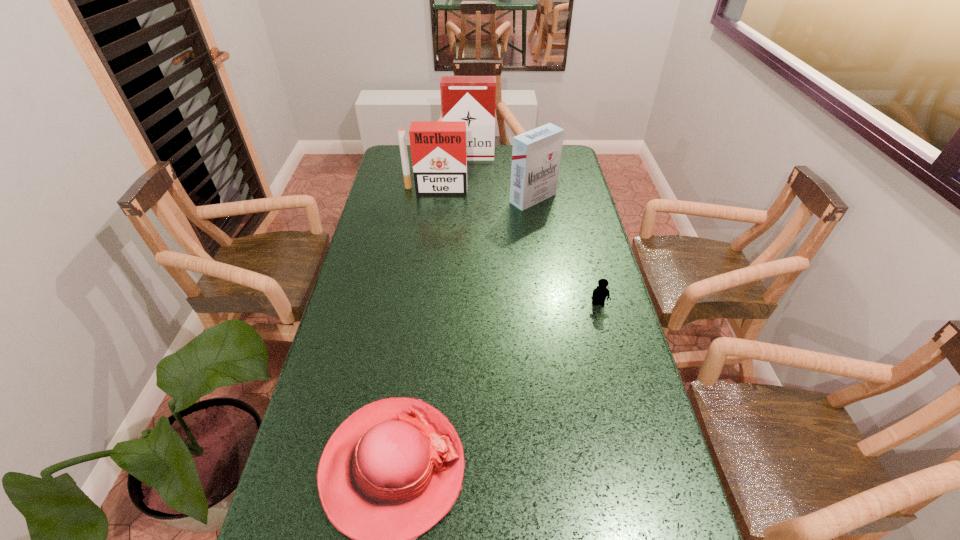
At what (x,y) coordinates should I click in order to perform the action: click on the tallest object. Please return your answer as a coordinate pair (x, y). This screenshot has width=960, height=540. Looking at the image, I should click on (472, 99).

I want to click on the tallest cigarette case, so click(x=472, y=99).

You are a GUI agent. You are given a task and a screenshot of the screen. Output one action in this format:
    pyautogui.click(x=<x>, y=<y>)
    Task: Click on the rightmost cigarette case
    
    Given the screenshot: What is the action you would take?
    pyautogui.click(x=536, y=154)

What are the coordinates of `the fourth farthest object` in the screenshot? It's located at (600, 293).

The height and width of the screenshot is (540, 960). I want to click on the shortest object, so click(x=600, y=293).

At what (x,y) coordinates should I click in order to perform the action: click on vacant point located on the front-facing side of the tallest cigarette case. Please return your answer as a coordinate pair (x, y). The width and height of the screenshot is (960, 540). Looking at the image, I should click on (468, 177).

You are a GUI agent. You are given a task and a screenshot of the screen. Output one action in this format:
    pyautogui.click(x=<x>, y=<y>)
    Task: Click on the vacant space located 0.260m on the back of the rightmost cigarette case
    This screenshot has width=960, height=540.
    Given the screenshot: What is the action you would take?
    pyautogui.click(x=526, y=156)

What are the coordinates of `free space located 0.140m on the front-facing side of the shortest object` in the screenshot? It's located at (609, 346).

Where is `object present at the far edge`? The width and height of the screenshot is (960, 540). object present at the far edge is located at coordinates (472, 99).

Image resolution: width=960 pixels, height=540 pixels. I want to click on object that is at the left edge, so click(x=439, y=154).